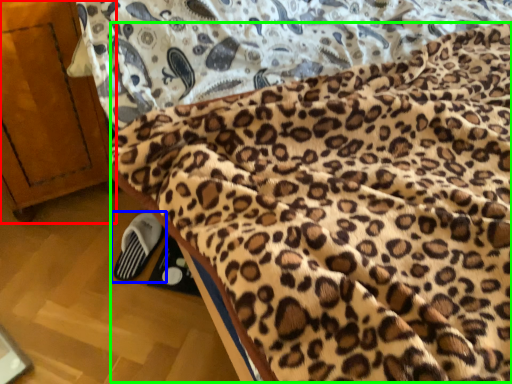
Question: Considering the real-world distances, which object is closest to furniture (highlighted by a red box)? footwear (highlighted by a blue box) or blanket (highlighted by a green box).

Choices:
 (A) footwear
 (B) blanket

Answer: (A)